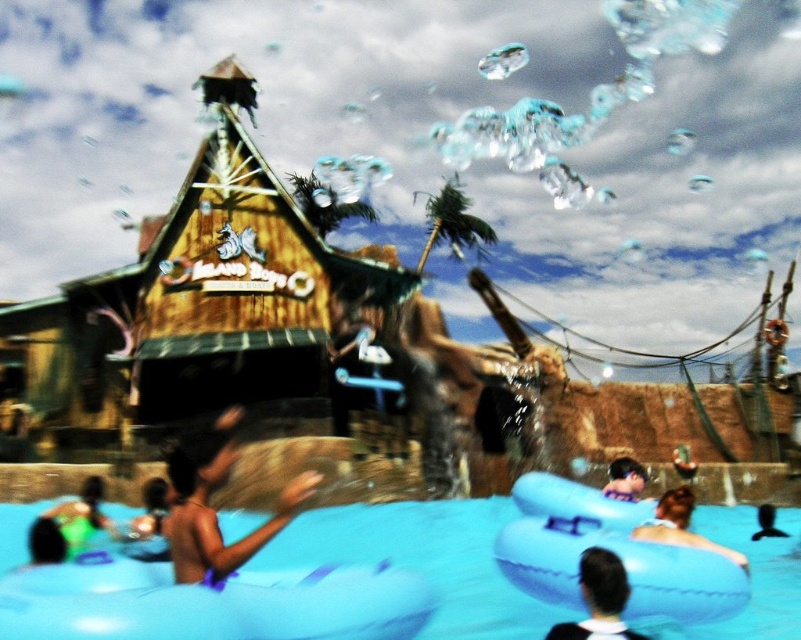
You are standing at the water park and want to take a photo of both the group of people in the pool and the wooden hut in the background. You notice two points marked as point 1 at coordinates point (715, 548) and point 2 at coordinates point (74, 518). Which point should you focus on first to ensure both subjects are in sharp focus?

You should focus on point 1 at coordinates point (715, 548) first because it is closer to the camera, ensuring that both the group in the pool and the wooden hut will be in focus when using depth of field appropriately.